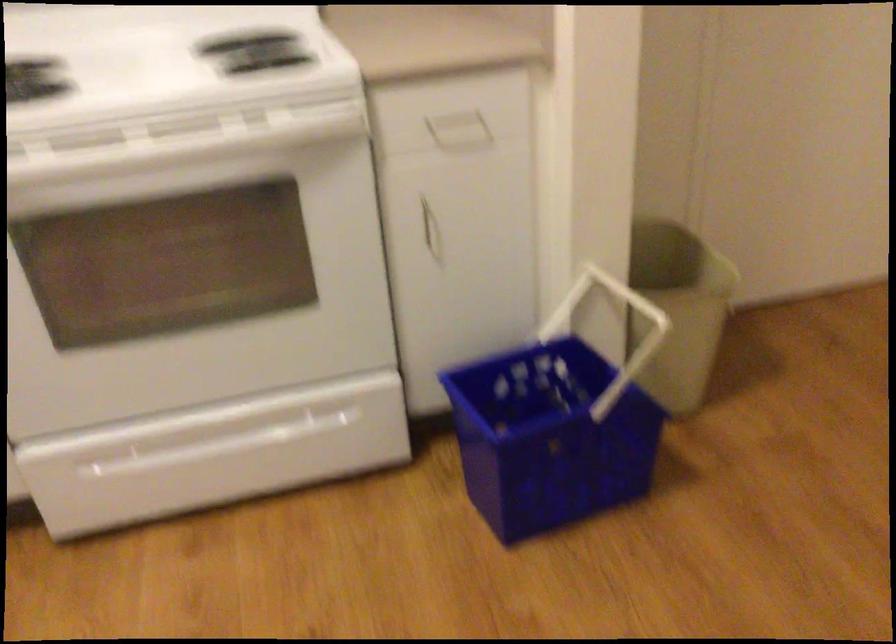
The width and height of the screenshot is (896, 644). In order to click on oven drawer handle in this screenshot , I will do (233, 440).